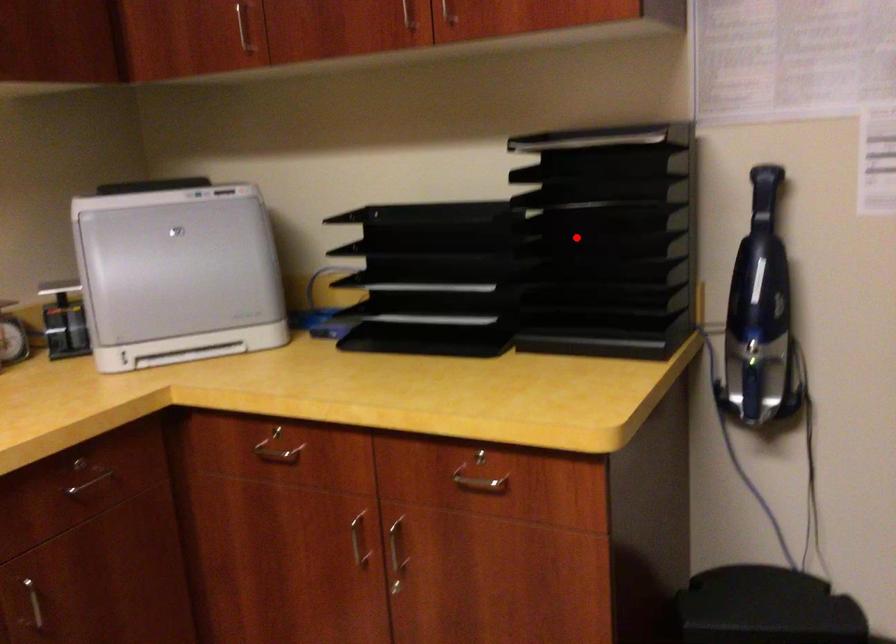
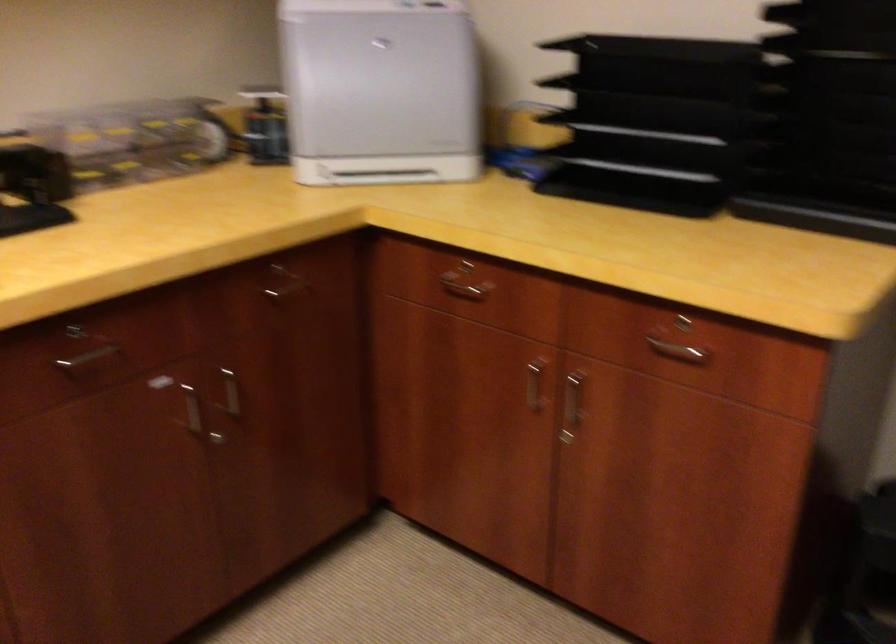
Question: I am providing you with two images of the same scene from different viewpoints. Given a red point in image1, look at the same physical point in image2. Is it:

Choices:
 (A) Closer to the viewpoint
 (B) Farther from the viewpoint

Answer: (A)